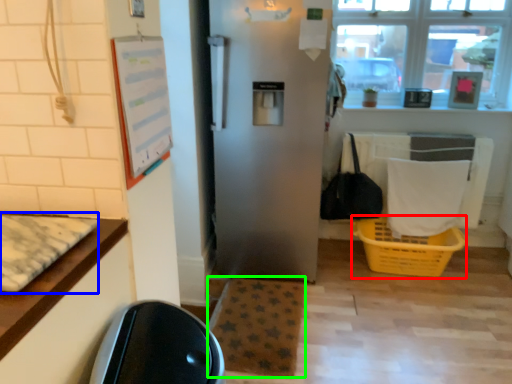
Question: Which object is positioned farthest from basket (highlighted by a red box)? Select from mat (highlighted by a blue box) and mat (highlighted by a green box).

Choices:
 (A) mat
 (B) mat

Answer: (A)